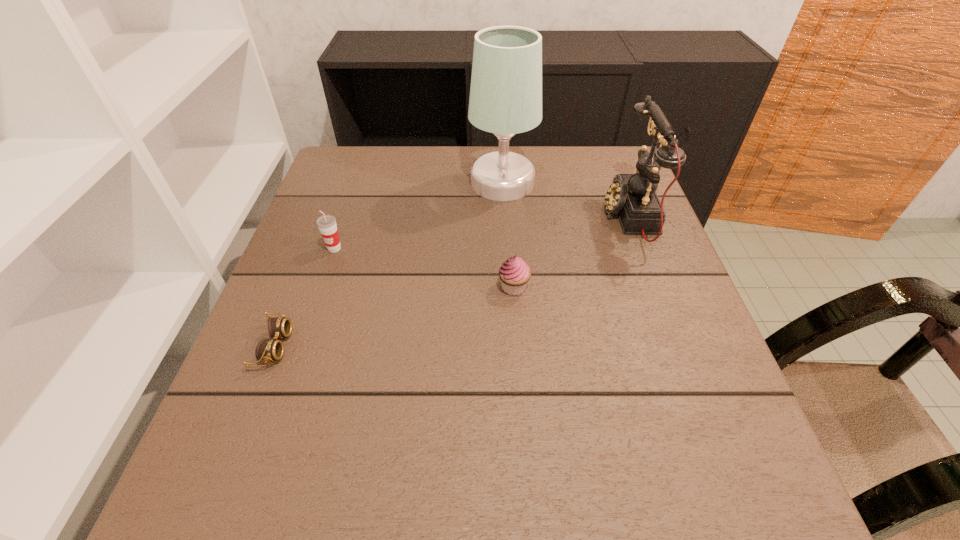
Locate an element on the screen. The width and height of the screenshot is (960, 540). cup that is positioned at the left edge is located at coordinates (327, 225).

Image resolution: width=960 pixels, height=540 pixels. In order to click on goggles located at the left edge in this screenshot , I will do `click(268, 350)`.

Where is `object at the right edge`? object at the right edge is located at coordinates (633, 197).

Identify the location of object located at the far right corner. The image size is (960, 540). (633, 197).

What are the coordinates of `vacant region at the far edge of the desktop` in the screenshot? It's located at (406, 161).

At what (x,y) coordinates should I click in order to perform the action: click on vacant space at the near edge of the desktop. Please return your answer as a coordinate pair (x, y). The width and height of the screenshot is (960, 540). Looking at the image, I should click on (524, 480).

Where is `vacant area at the left edge of the desktop`? vacant area at the left edge of the desktop is located at coordinates (301, 367).

Identify the location of vacant space at the right edge of the desktop. (638, 304).

Image resolution: width=960 pixels, height=540 pixels. Identify the location of free space at the far left corner of the desktop. (377, 157).

The width and height of the screenshot is (960, 540). In the image, there is a desktop. What are the coordinates of `vacant space at the near left corner` in the screenshot? It's located at (216, 476).